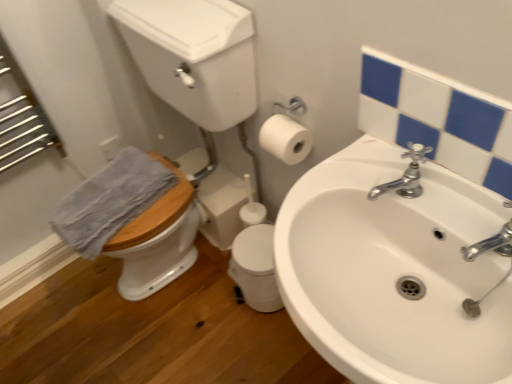
Question: Considering the relative sizes of wooden at left and white ceramic sink at center in the image provided, is wooden at left taller than white ceramic sink at center?

Choices:
 (A) yes
 (B) no

Answer: (A)

Question: Considering the relative sizes of wooden at left and white ceramic sink at center in the image provided, is wooden at left wider than white ceramic sink at center?

Choices:
 (A) yes
 (B) no

Answer: (A)

Question: From the image's perspective, would you say wooden at left is shown under white ceramic sink at center?

Choices:
 (A) no
 (B) yes

Answer: (A)

Question: Is white ceramic sink at center inside wooden at left?

Choices:
 (A) yes
 (B) no

Answer: (B)

Question: Is wooden at left turned away from white ceramic sink at center?

Choices:
 (A) no
 (B) yes

Answer: (A)

Question: Is wooden at left far away from white ceramic sink at center?

Choices:
 (A) no
 (B) yes

Answer: (A)

Question: Can you confirm if blue textured towel at left is taller than silver metallic faucet at upper right?

Choices:
 (A) yes
 (B) no

Answer: (B)

Question: Considering the relative sizes of blue textured towel at left and silver metallic faucet at upper right in the image provided, is blue textured towel at left thinner than silver metallic faucet at upper right?

Choices:
 (A) yes
 (B) no

Answer: (B)

Question: Is blue textured towel at left wider than silver metallic faucet at upper right?

Choices:
 (A) no
 (B) yes

Answer: (B)

Question: From a real-world perspective, is blue textured towel at left under silver metallic faucet at upper right?

Choices:
 (A) yes
 (B) no

Answer: (A)

Question: Considering the relative sizes of blue textured towel at left and silver metallic faucet at upper right in the image provided, is blue textured towel at left bigger than silver metallic faucet at upper right?

Choices:
 (A) no
 (B) yes

Answer: (B)

Question: Is blue textured towel at left aimed at silver metallic faucet at upper right?

Choices:
 (A) yes
 (B) no

Answer: (B)

Question: Is white ceramic sink at center touching white glossy mirror at upper right?

Choices:
 (A) yes
 (B) no

Answer: (B)